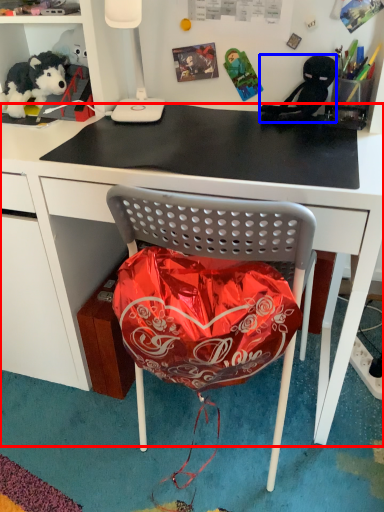
Question: Which point is closer to the camera, desk (highlighted by a red box) or person (highlighted by a blue box)?

Choices:
 (A) desk
 (B) person

Answer: (A)